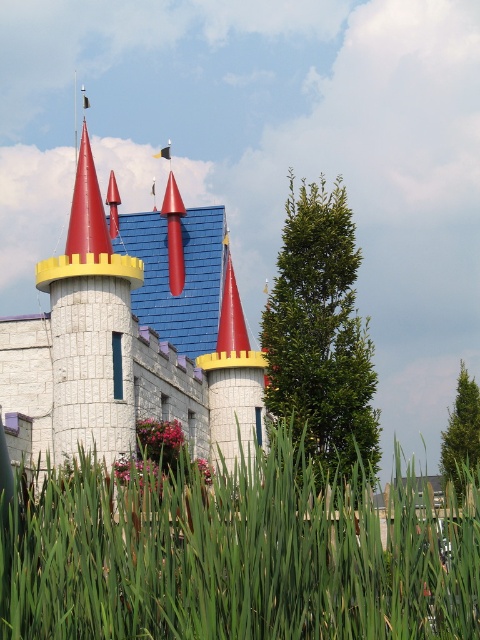
You are standing in front of the white plastic castle at center and want to walk towards the green grass at lower center. Which direction should you move relative to the castle?

The green grass at lower center is to the right of the white plastic castle at center, so you should move to the right side of the castle to reach it.

You are standing in front of the castle and want to place a small garden decoration exactly at the green grass at lower center. What are the coordinates where you should place it?

The coordinates for the green grass at lower center are at point (233, 557).